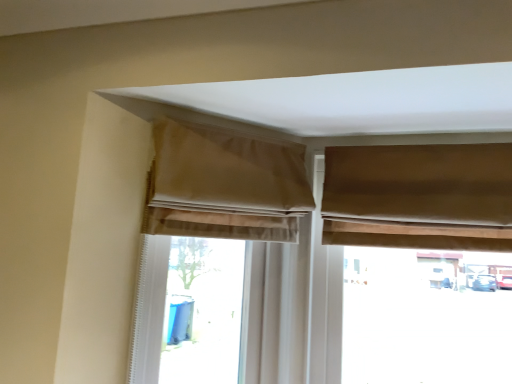
Question: Is the position of beige fabric window at upper center less distant than that of beige fabric curtain at upper left, the third curtain when ordered from right to left?

Choices:
 (A) yes
 (B) no

Answer: (B)

Question: Are beige fabric window at upper center and beige fabric curtain at upper left, the 1th curtain from the left, far apart?

Choices:
 (A) yes
 (B) no

Answer: (B)

Question: From the image's perspective, is beige fabric window at upper center under beige fabric curtain at upper left, the third curtain when ordered from right to left?

Choices:
 (A) no
 (B) yes

Answer: (B)

Question: Could you tell me if beige fabric window at upper center is turned towards beige fabric curtain at upper left, the 1th curtain from the left?

Choices:
 (A) yes
 (B) no

Answer: (B)

Question: Does beige fabric window at upper center have a greater width compared to beige fabric curtain at upper left, the third curtain when ordered from right to left?

Choices:
 (A) no
 (B) yes

Answer: (A)

Question: Considering the relative positions of beige fabric window at upper center and beige fabric curtain at upper left, the third curtain when ordered from right to left, in the image provided, is beige fabric window at upper center behind beige fabric curtain at upper left, the third curtain when ordered from right to left,?

Choices:
 (A) no
 (B) yes

Answer: (B)

Question: Is beige fabric window at upper center not near beige fabric curtain at upper center, the second curtain in the left-to-right sequence?

Choices:
 (A) yes
 (B) no

Answer: (B)

Question: From a real-world perspective, is beige fabric window at upper center beneath beige fabric curtain at upper center, the second curtain in the left-to-right sequence?

Choices:
 (A) no
 (B) yes

Answer: (B)

Question: Can you confirm if beige fabric window at upper center is smaller than beige fabric curtain at upper center, which is the 2th curtain from right to left?

Choices:
 (A) yes
 (B) no

Answer: (B)

Question: Is beige fabric window at upper center positioned behind beige fabric curtain at upper center, which is the 2th curtain from right to left?

Choices:
 (A) no
 (B) yes

Answer: (B)

Question: Could you tell me if beige fabric window at upper center is facing beige fabric curtain at upper center, which is the 2th curtain from right to left?

Choices:
 (A) yes
 (B) no

Answer: (B)

Question: From the image's perspective, does beige fabric window at upper center appear lower than beige fabric curtain at upper center, the second curtain in the left-to-right sequence?

Choices:
 (A) no
 (B) yes

Answer: (B)

Question: Does beige fabric curtain at upper center, which is the 2th curtain from right to left, lie behind beige fabric curtain at upper left, the 1th curtain from the left?

Choices:
 (A) no
 (B) yes

Answer: (A)